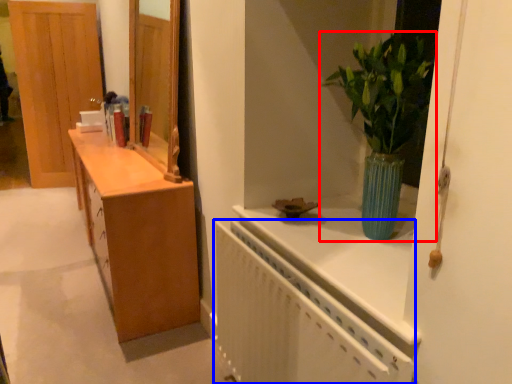
Question: Which of the following is the farthest to the observer, houseplant (highlighted by a red box) or radiator (highlighted by a blue box)?

Choices:
 (A) houseplant
 (B) radiator

Answer: (A)